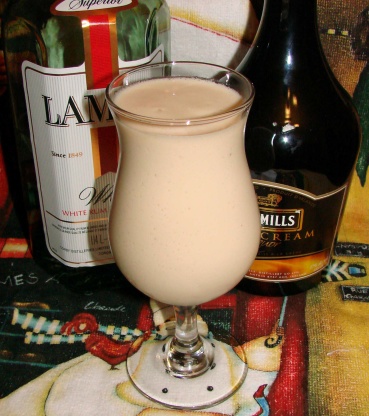
Identify the location of table mat. (97, 339).